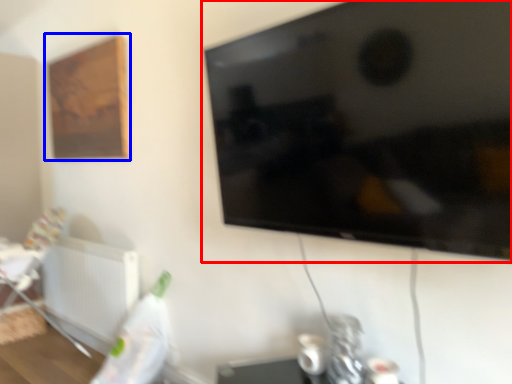
Question: Which object appears closest to the camera in this image, television (highlighted by a red box) or picture frame (highlighted by a blue box)?

Choices:
 (A) television
 (B) picture frame

Answer: (A)